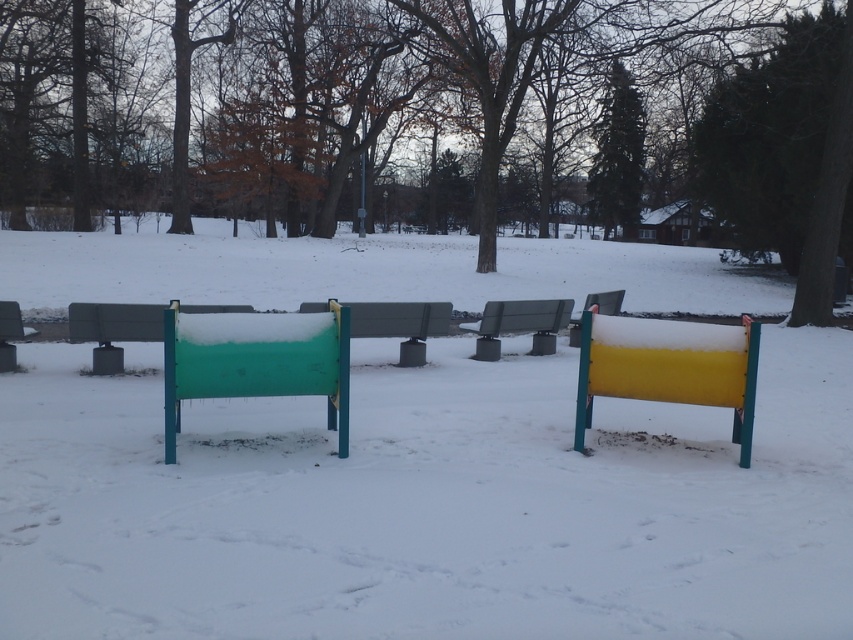
Can you confirm if yellow matte bench at right is positioned to the left of metallic gray bench at center?

No, yellow matte bench at right is not to the left of metallic gray bench at center.

Can you confirm if yellow matte bench at right is shorter than metallic gray bench at center?

Incorrect, yellow matte bench at right's height does not fall short of metallic gray bench at center's.

Where is `yellow matte bench at right`? The height and width of the screenshot is (640, 853). yellow matte bench at right is located at coordinates (669, 368).

Identify the location of yellow matte bench at right. (669, 368).

Is green painted wood at upper center to the left of green plastic bench at center from the viewer's perspective?

Incorrect, green painted wood at upper center is not on the left side of green plastic bench at center.

Which is in front, point (631, 188) or point (192, 305)?

Positioned in front is point (192, 305).

Which is behind, point (608, 170) or point (96, 352)?

Point (608, 170)

You are a GUI agent. You are given a task and a screenshot of the screen. Output one action in this format:
    pyautogui.click(x=<x>, y=<y>)
    Task: Click on the green painted wood at upper center
    Image resolution: width=853 pixels, height=640 pixels.
    Given the screenshot: What is the action you would take?
    pyautogui.click(x=618, y=156)

Can you confirm if green painted wood at upper right is taller than green painted wood at upper center?

No.

What do you see at coordinates (786, 154) in the screenshot?
I see `green painted wood at upper right` at bounding box center [786, 154].

This screenshot has width=853, height=640. What are the coordinates of `green painted wood at upper right` in the screenshot? It's located at (786, 154).

Image resolution: width=853 pixels, height=640 pixels. Find the location of `green painted wood at upper right`. green painted wood at upper right is located at coordinates (786, 154).